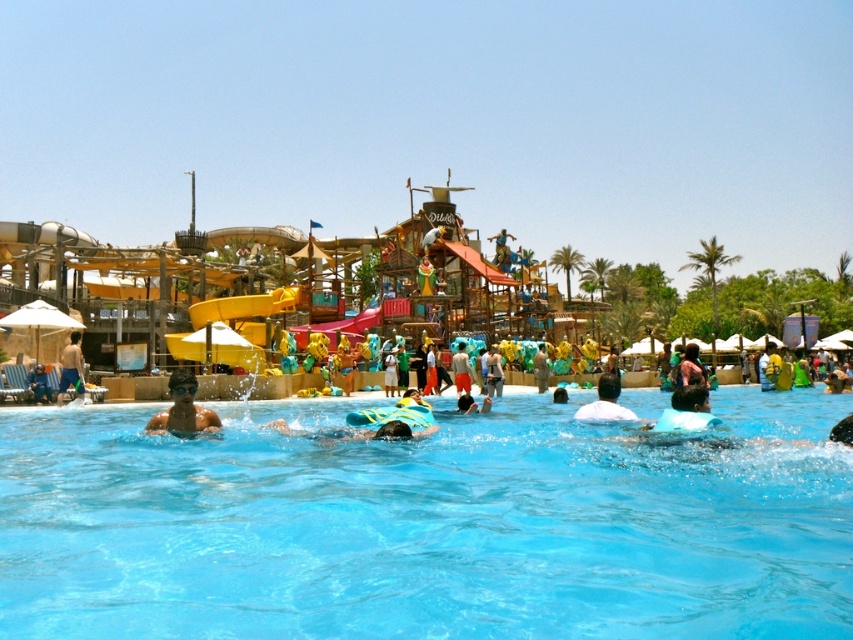
Question: Can you confirm if matte black swimmer at lower left is wider than light brown skin at left?

Choices:
 (A) no
 (B) yes

Answer: (A)

Question: Which object appears closest to the camera in this image?

Choices:
 (A) wooden pirate ship at center
 (B) white matte shirt at center
 (C) orange shorts at center

Answer: (B)

Question: Which of the following is the farthest from the observer?

Choices:
 (A) transparent blue water at center
 (B) orange shorts at center

Answer: (B)

Question: Is wooden pirate ship at center above light brown skin at left?

Choices:
 (A) yes
 (B) no

Answer: (A)

Question: Which point is closer to the camera?

Choices:
 (A) white matte shirt at center
 (B) transparent blue water at center
 (C) light brown skin at left

Answer: (B)

Question: Is white matte shirt at center wider than orange shorts at center?

Choices:
 (A) yes
 (B) no

Answer: (A)